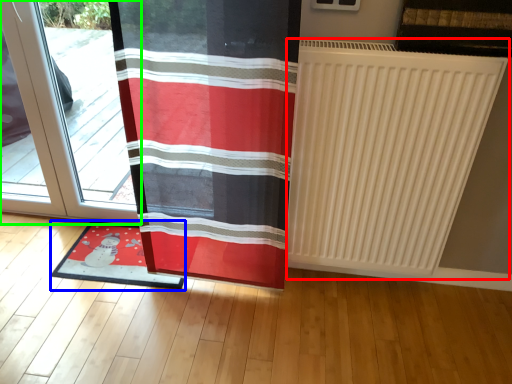
Question: Based on their relative distances, which object is nearer to radiator (highlighted by a red box)? Choose from mat (highlighted by a blue box) and door (highlighted by a green box).

Choices:
 (A) mat
 (B) door

Answer: (A)